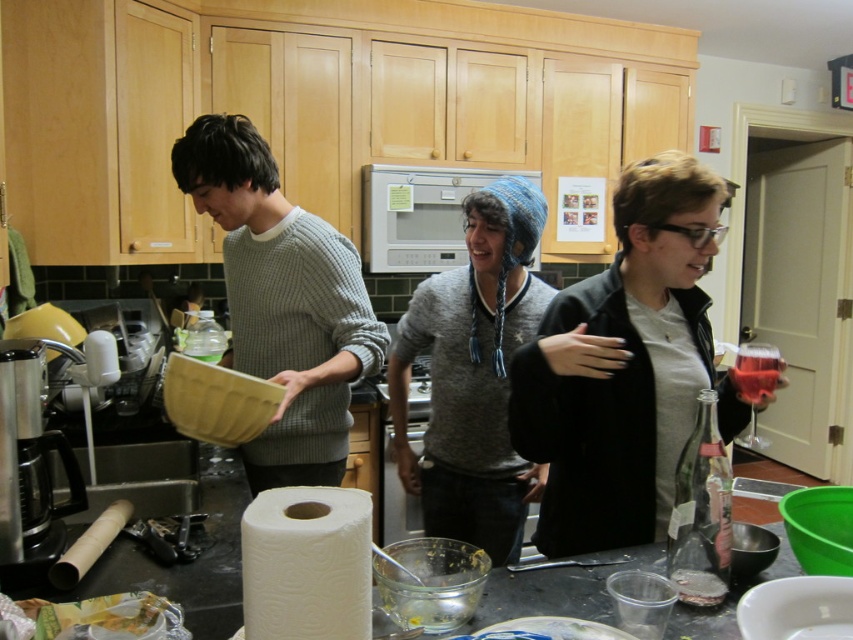
Describe the element at coordinates (622, 365) in the screenshot. This screenshot has width=853, height=640. I see `matte black jacket at center` at that location.

Who is positioned more to the right, matte black jacket at center or white paper towel at center?

Positioned to the right is matte black jacket at center.

Which is in front, point (666, 486) or point (282, 500)?

Point (282, 500)

Find the location of a particular element. This screenshot has height=640, width=853. matte black jacket at center is located at coordinates (622, 365).

Between white paper towel at center and translucent glass wine at right, which one has more height?

With more height is white paper towel at center.

Is white paper towel at center positioned in front of translucent glass wine at right?

Yes, white paper towel at center is closer to the viewer.

I want to click on white paper towel at center, so click(306, 564).

Does matte black jacket at center appear under clear glass bottle at lower right?

No, matte black jacket at center is not below clear glass bottle at lower right.

Which is more to the right, matte black jacket at center or clear glass bottle at lower right?

clear glass bottle at lower right is more to the right.

In the scene shown: Who is more distant from viewer, [714,378] or [712,486]?

Positioned behind is point [714,378].

Find the location of a particular element. The image size is (853, 640). matte black jacket at center is located at coordinates (622, 365).